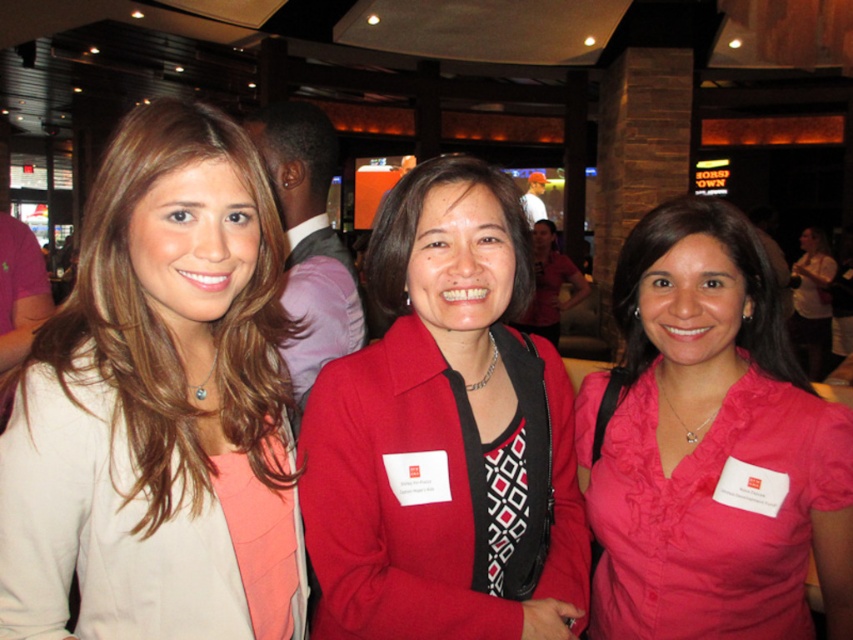
Is matte beige blazer at left below matte red blazer at center?

No, matte beige blazer at left is not below matte red blazer at center.

Based on the photo, does matte beige blazer at left have a greater height compared to matte red blazer at center?

Indeed, matte beige blazer at left has a greater height compared to matte red blazer at center.

What do you see at coordinates (149, 394) in the screenshot? The height and width of the screenshot is (640, 853). I see `matte beige blazer at left` at bounding box center [149, 394].

The image size is (853, 640). I want to click on matte beige blazer at left, so click(x=149, y=394).

Is point (418, 285) positioned after point (811, 465)?

That is False.

Is matte red blazer at center wider than pink satin blouse at center?

Indeed, matte red blazer at center has a greater width compared to pink satin blouse at center.

The image size is (853, 640). Describe the element at coordinates (445, 435) in the screenshot. I see `matte red blazer at center` at that location.

Find the location of a particular element. matte red blazer at center is located at coordinates (445, 435).

Can you confirm if matte beige blazer at left is bigger than pink fabric shirt at right?

Actually, matte beige blazer at left might be smaller than pink fabric shirt at right.

Where is `matte beige blazer at left`? matte beige blazer at left is located at coordinates (149, 394).